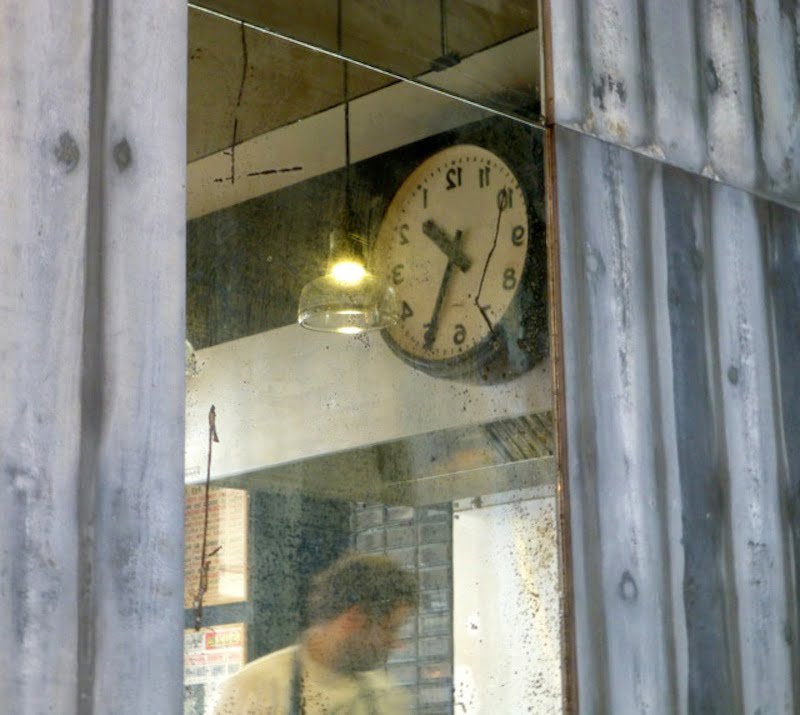
The height and width of the screenshot is (715, 800). In order to click on clock in this screenshot , I will do `click(462, 280)`.